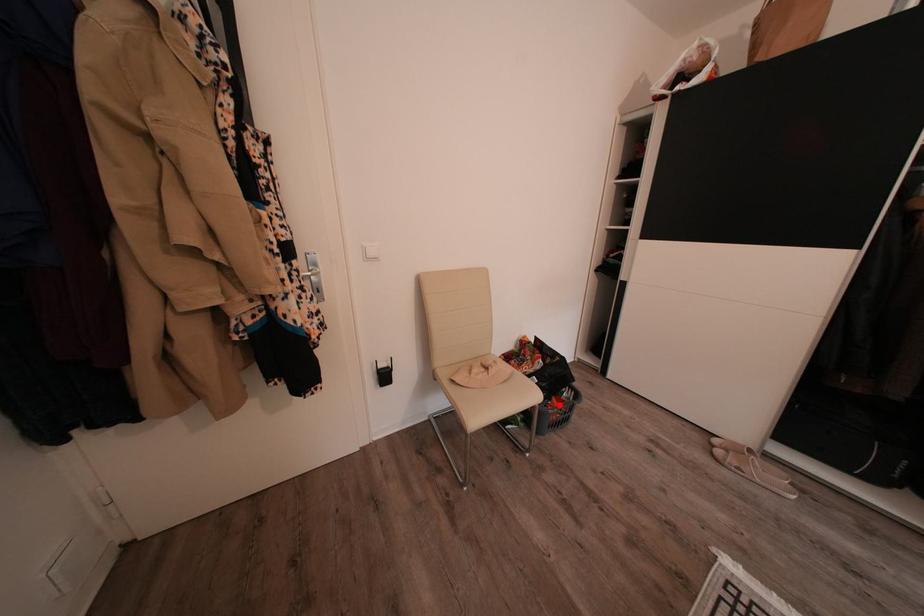
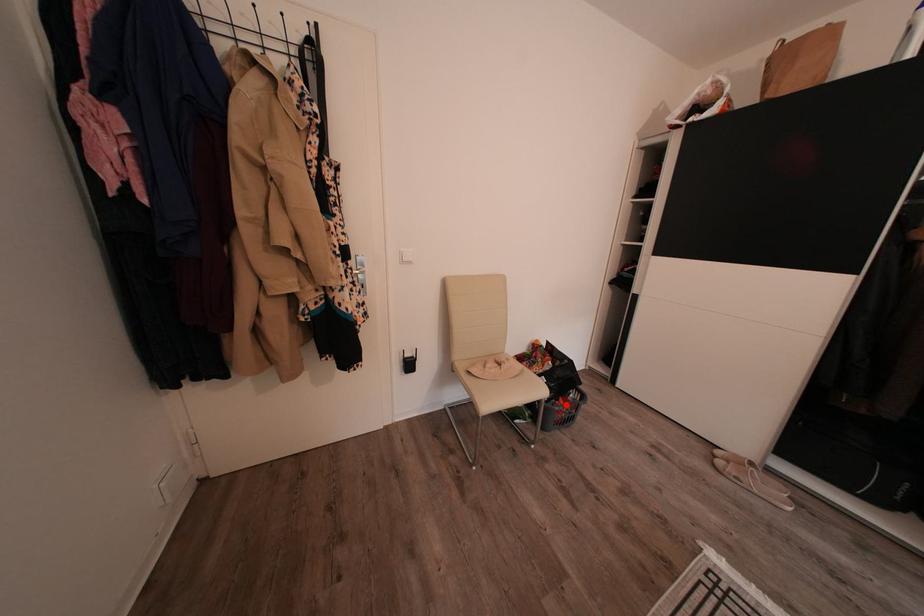
I am providing you with two images of the same scene from different viewpoints. A red point is marked on the first image and another point is marked on the second image. Does the point marked in image1 correspond to the same location as the one in image2?

Yes